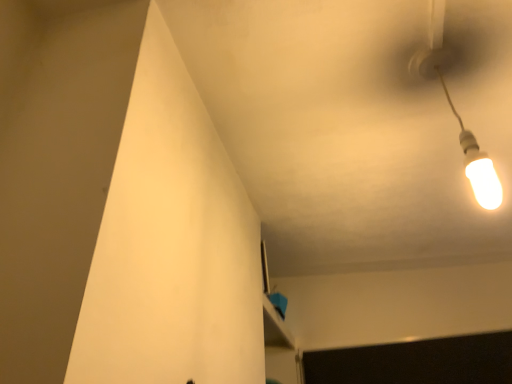
Describe the element at coordinates (456, 111) in the screenshot. I see `white glossy bulb at upper right` at that location.

The image size is (512, 384). Find the location of `white glossy bulb at upper right`. white glossy bulb at upper right is located at coordinates (456, 111).

Identify the location of white glossy bulb at upper right. (456, 111).